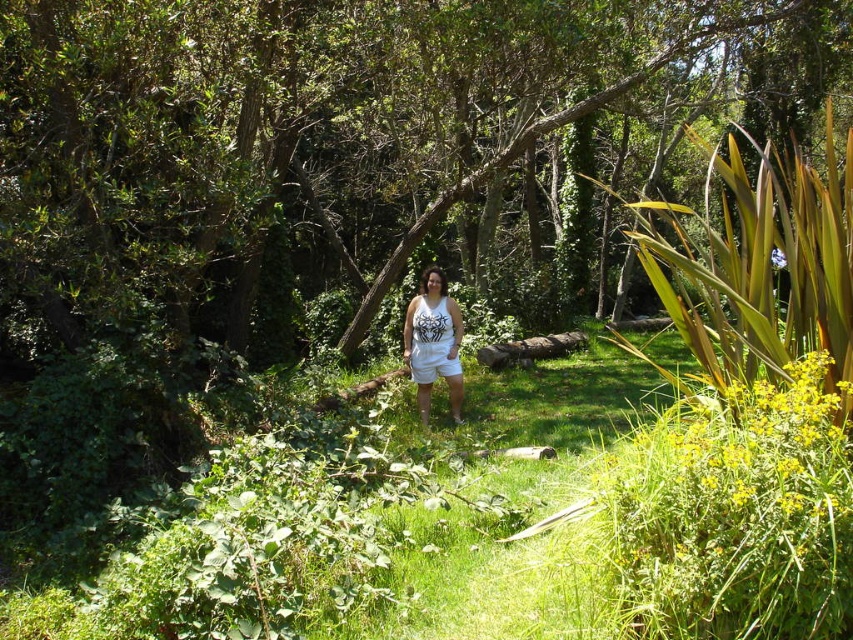
What do you see at coordinates (296, 540) in the screenshot? This screenshot has height=640, width=853. I see `green grass at center` at bounding box center [296, 540].

Which is in front, point (548, 481) or point (424, 307)?

Point (548, 481) is more forward.

Is point (790, 596) farther from camera compared to point (416, 362)?

No, it is not.

Where is `green grass at center`? The image size is (853, 640). green grass at center is located at coordinates (296, 540).